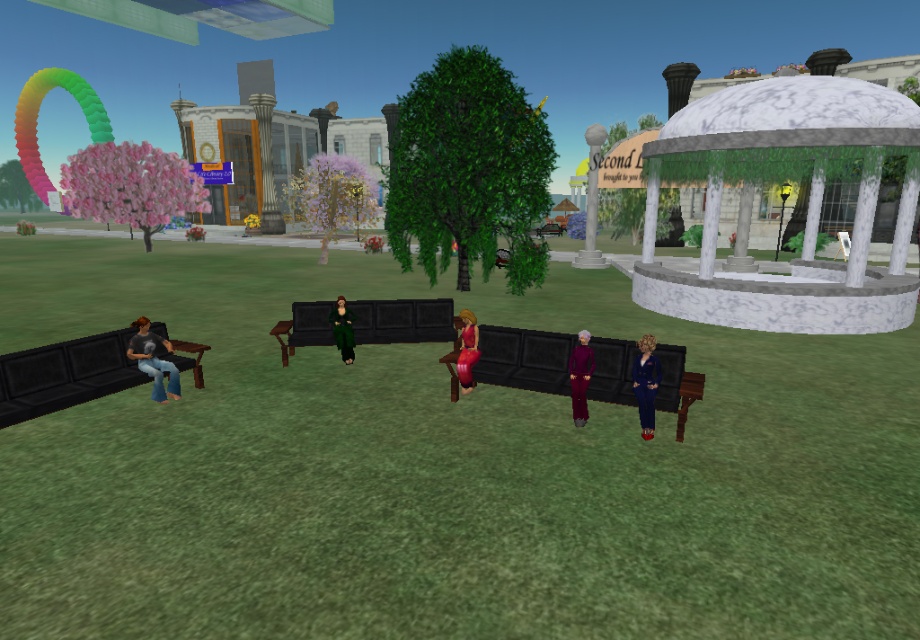
Question: Considering the real-world distances, which object is farthest from the shiny red dress at center?

Choices:
 (A) purple velvet dress at center
 (B) shiny green coat at center

Answer: (B)

Question: Which object is farther from the camera taking this photo?

Choices:
 (A) purple velvet dress at center
 (B) shiny green coat at center
 (C) shiny black bench at center

Answer: (C)

Question: Can you confirm if black leather bench at center is positioned below shiny red dress at center?

Choices:
 (A) yes
 (B) no

Answer: (A)

Question: Is black leather bench at center thinner than blue fabric dress at lower right?

Choices:
 (A) yes
 (B) no

Answer: (B)

Question: Is black leather bench at center closer to the viewer compared to shiny green coat at center?

Choices:
 (A) yes
 (B) no

Answer: (A)

Question: Which is farther from the black leather bench at center?

Choices:
 (A) matte black bench at left
 (B) matte black shirt at left

Answer: (A)